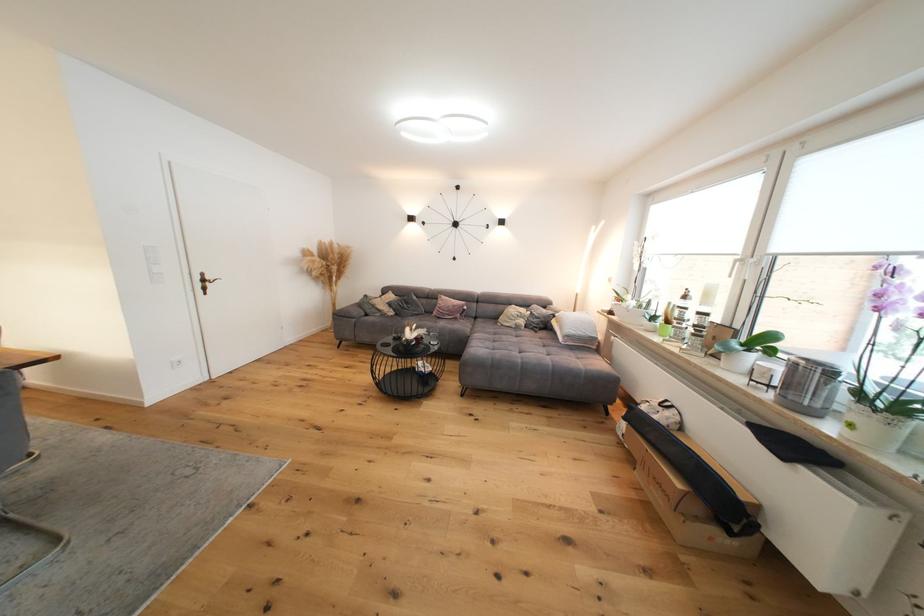
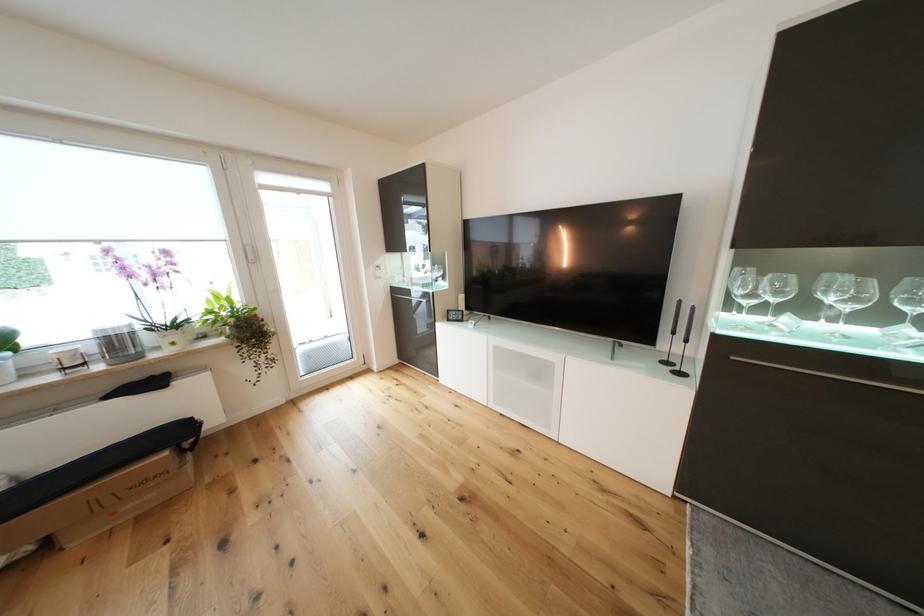
Find the pixel in the second image that matches (858,427) in the first image.

(180, 345)